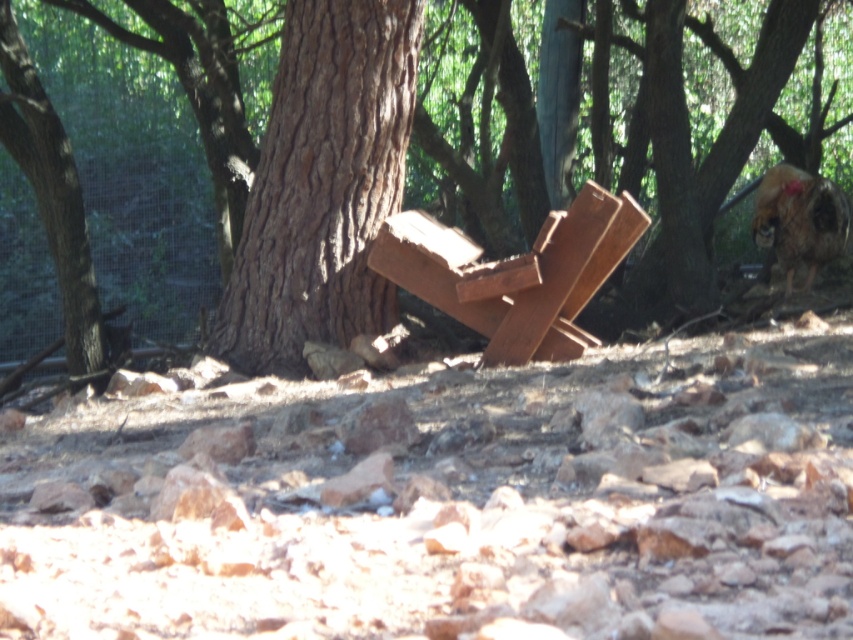
Image resolution: width=853 pixels, height=640 pixels. In order to click on brown rough tree trunk at center in this screenshot , I will do `click(692, 163)`.

I want to click on brown rough tree trunk at center, so click(x=692, y=163).

Which is in front, point (352, 120) or point (543, 337)?

Positioned in front is point (543, 337).

Where is `brown rough bark tree at center`? The image size is (853, 640). brown rough bark tree at center is located at coordinates (322, 184).

In the scene shown: Is brown rough tree trunk at center in front of brown rough bark tree at center?

Yes.

Does brown rough tree trunk at center have a larger size compared to brown rough bark tree at center?

No, brown rough tree trunk at center is not bigger than brown rough bark tree at center.

You are a GUI agent. You are given a task and a screenshot of the screen. Output one action in this format:
    pyautogui.click(x=<x>, y=<y>)
    Task: Click on the brown rough tree trunk at center
    This screenshot has width=853, height=640.
    Given the screenshot: What is the action you would take?
    pyautogui.click(x=692, y=163)